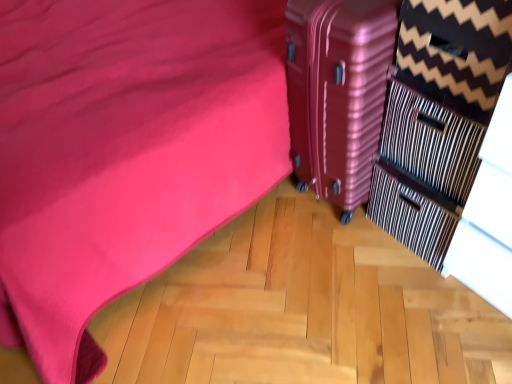
Question: Considering the relative positions of striped fabric dresser at right and metallic pink suitcase at right in the image provided, is striped fabric dresser at right to the right of metallic pink suitcase at right from the viewer's perspective?

Choices:
 (A) no
 (B) yes

Answer: (B)

Question: From the image's perspective, is striped fabric dresser at right located beneath metallic pink suitcase at right?

Choices:
 (A) no
 (B) yes

Answer: (B)

Question: Is metallic pink suitcase at right completely or partially inside striped fabric dresser at right?

Choices:
 (A) yes
 (B) no

Answer: (B)

Question: From a real-world perspective, is striped fabric dresser at right positioned under metallic pink suitcase at right based on gravity?

Choices:
 (A) yes
 (B) no

Answer: (B)

Question: Does striped fabric dresser at right lie in front of metallic pink suitcase at right?

Choices:
 (A) no
 (B) yes

Answer: (B)

Question: Is striped fabric dresser at right with metallic pink suitcase at right?

Choices:
 (A) yes
 (B) no

Answer: (B)

Question: Considering the relative sizes of metallic pink suitcase at right and striped fabric dresser at right in the image provided, is metallic pink suitcase at right wider than striped fabric dresser at right?

Choices:
 (A) yes
 (B) no

Answer: (A)

Question: Can you confirm if metallic pink suitcase at right is bigger than striped fabric dresser at right?

Choices:
 (A) yes
 (B) no

Answer: (A)

Question: Is metallic pink suitcase at right behind striped fabric dresser at right?

Choices:
 (A) yes
 (B) no

Answer: (A)

Question: Is striped fabric dresser at right inside metallic pink suitcase at right?

Choices:
 (A) yes
 (B) no

Answer: (B)

Question: Is metallic pink suitcase at right to the left of striped fabric dresser at right from the viewer's perspective?

Choices:
 (A) yes
 (B) no

Answer: (A)

Question: Does metallic pink suitcase at right have a lesser height compared to striped fabric dresser at right?

Choices:
 (A) yes
 (B) no

Answer: (B)

Question: Is striped fabric dresser at right bigger or smaller than metallic pink suitcase at right?

Choices:
 (A) small
 (B) big

Answer: (A)